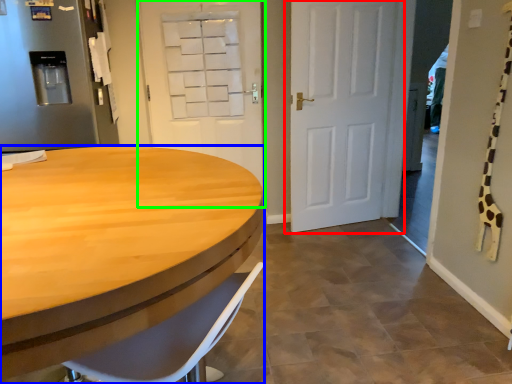
Question: Which object is positioned farthest from door (highlighted by a red box)? Select from desk (highlighted by a blue box) and door (highlighted by a green box).

Choices:
 (A) desk
 (B) door

Answer: (A)